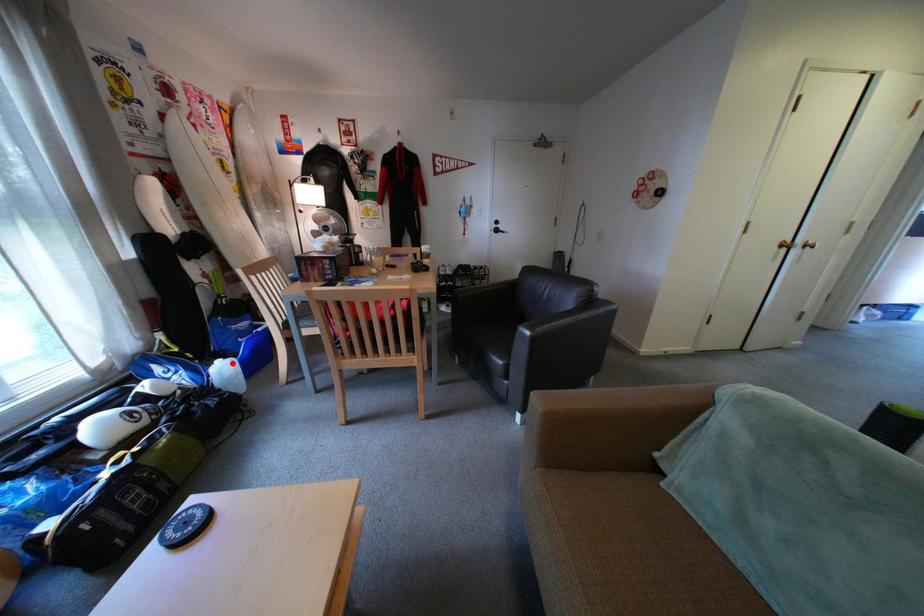
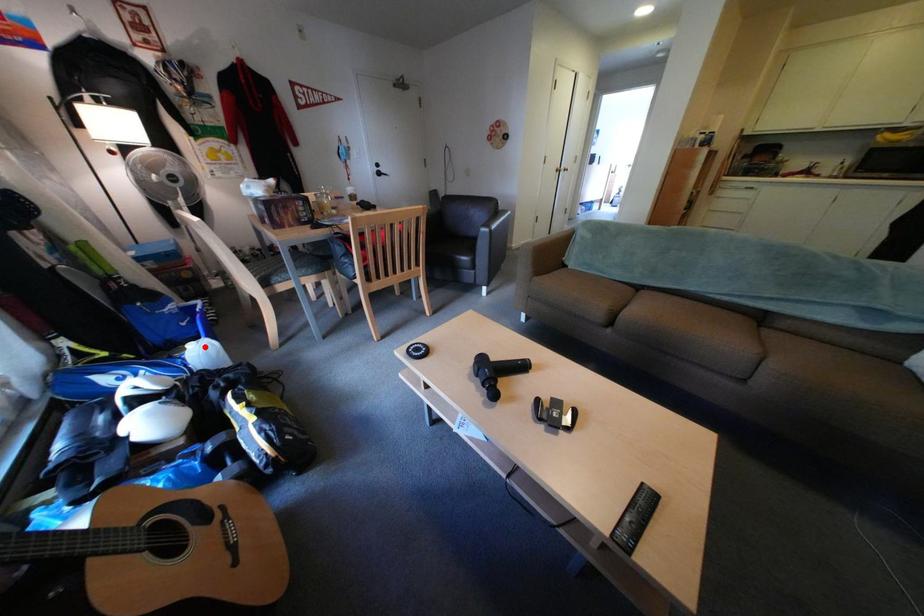
I am providing you with two images of the same scene from different viewpoints. A red point is marked on the first image and another point is marked on the second image. Are the points marked in image1 and image2 representing the same 3D position?

Yes